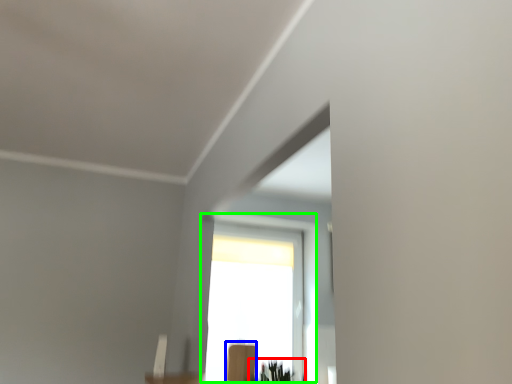
Question: Based on their relative distances, which object is farther from plant (highlighted by a red box)? Choose from furniture (highlighted by a blue box) and window (highlighted by a green box).

Choices:
 (A) furniture
 (B) window

Answer: (B)